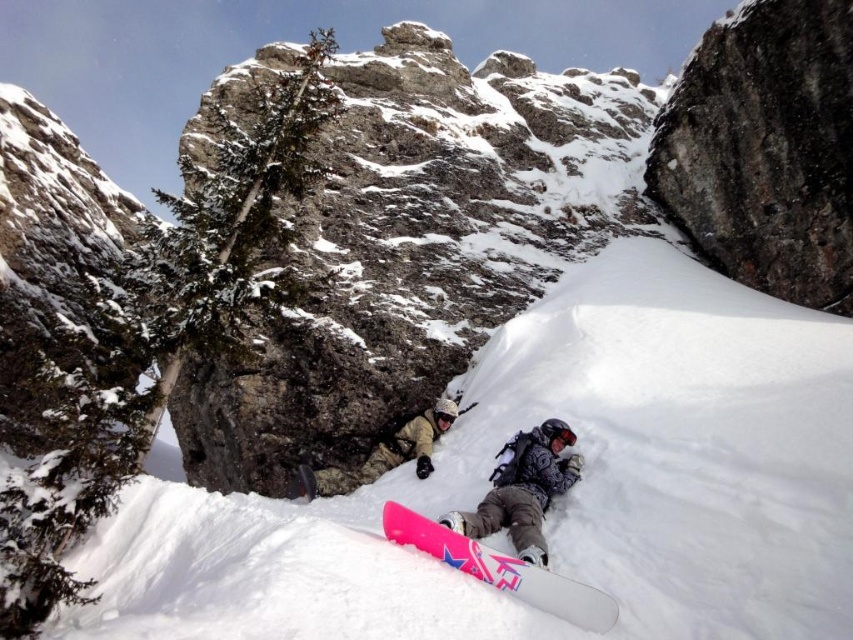
You are a photographer standing at the camera position in the image. You want to capture a closeup shot of the matte black snowboard at lower center. Given that your camera can focus on objects within 50 meters, will you be able to take the closeup photo?

The matte black snowboard at lower center is 49.29 meters away from the camera. Since the camera can focus on objects within 50 meters, you can take the closeup photo as the distance is within the focus range.